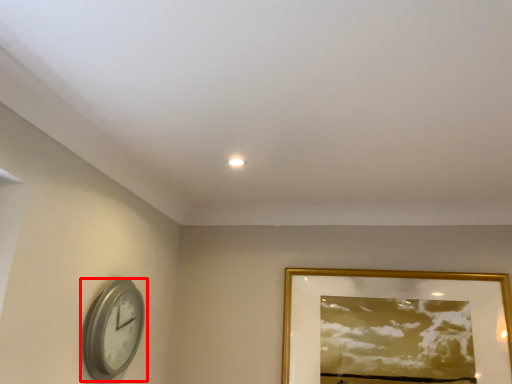
Question: Considering the relative positions of wall clock (annotated by the red box) and picture frame in the image provided, where is wall clock (annotated by the red box) located with respect to the staircase?

Choices:
 (A) left
 (B) right

Answer: (A)